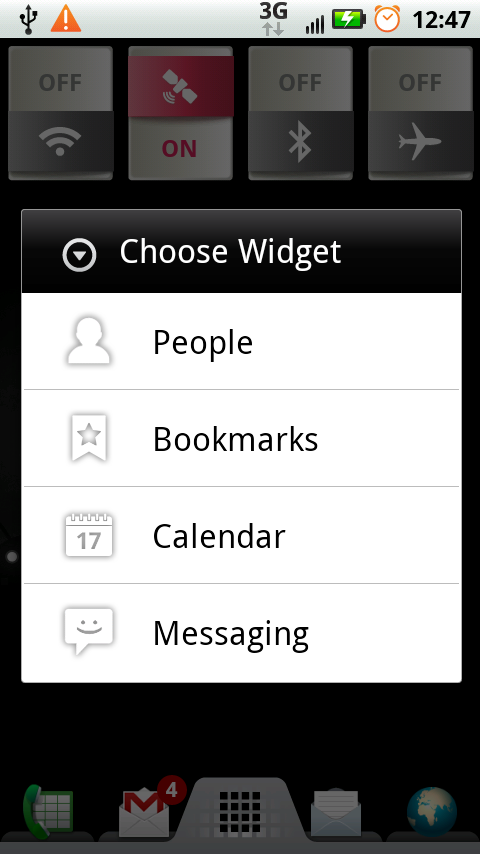
Find the location of a particular element. The width and height of the screenshot is (480, 854). wifi is located at coordinates (63, 145).